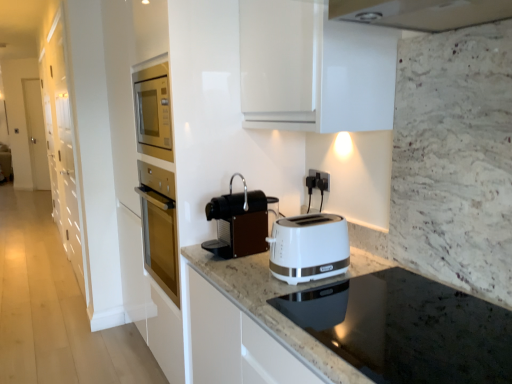
Question: Visually, is white plastic toaster at center positioned to the left or to the right of black plastic electrical outlet at center?

Choices:
 (A) right
 (B) left

Answer: (B)

Question: Considering their positions, is white plastic toaster at center located in front of or behind black plastic electrical outlet at center?

Choices:
 (A) front
 (B) behind

Answer: (A)

Question: Considering the real-world distances, which object is farthest from the black granite countertop at lower center?

Choices:
 (A) brown matte coffee machine at center
 (B) white plastic toaster at center
 (C) black plastic electrical outlet at center
 (D) white glossy cabinet at left

Answer: (D)

Question: Considering the real-world distances, which object is farthest from the white plastic toaster at center?

Choices:
 (A) black granite countertop at lower center
 (B) black plastic electrical outlet at center
 (C) white glossy cabinet at left
 (D) brown matte coffee machine at center

Answer: (C)